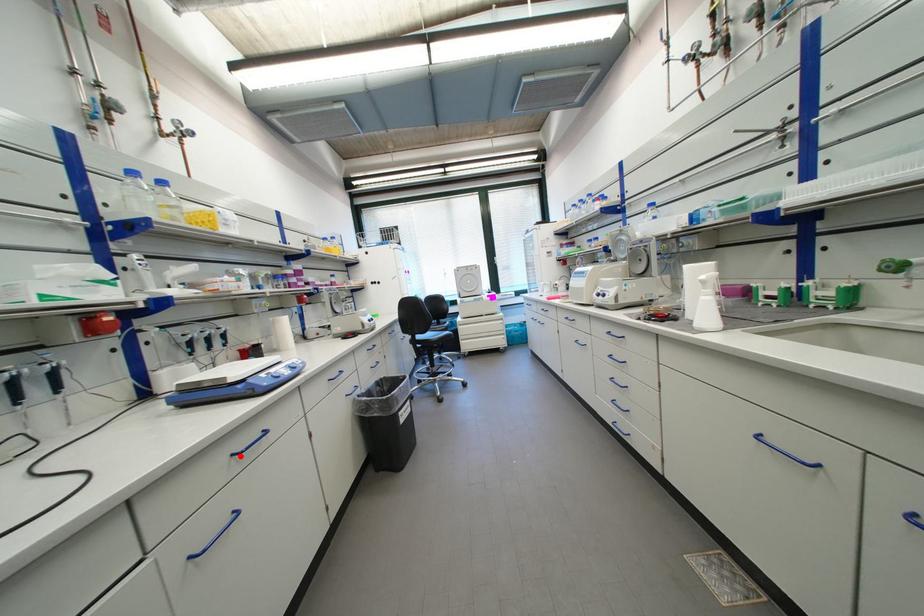
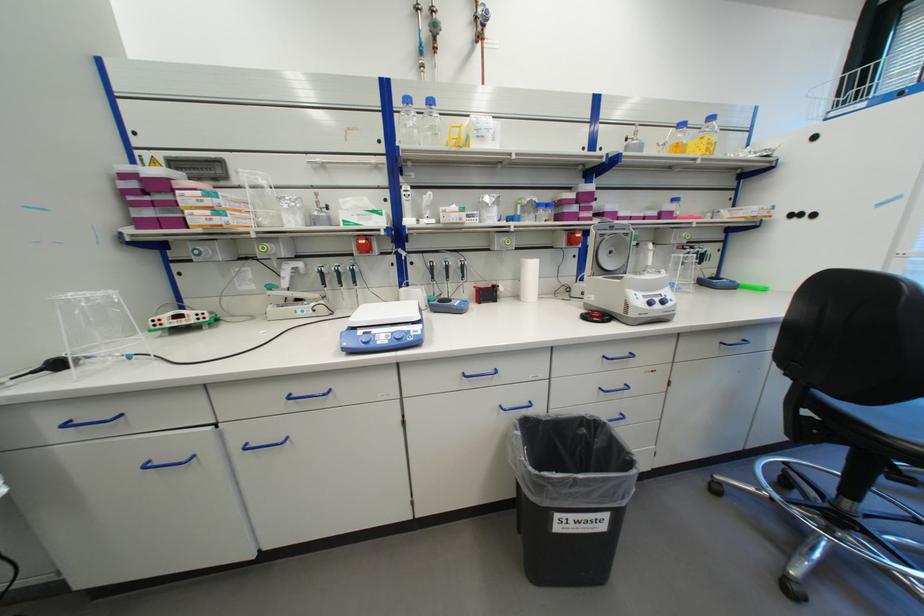
Find the pixel in the second image that matches the highlighted location in the first image.

(298, 395)